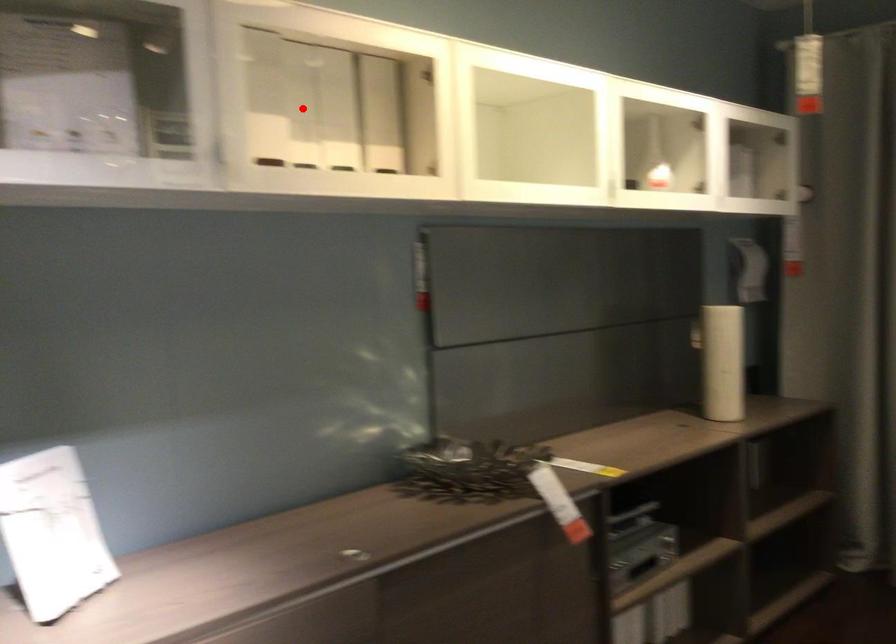
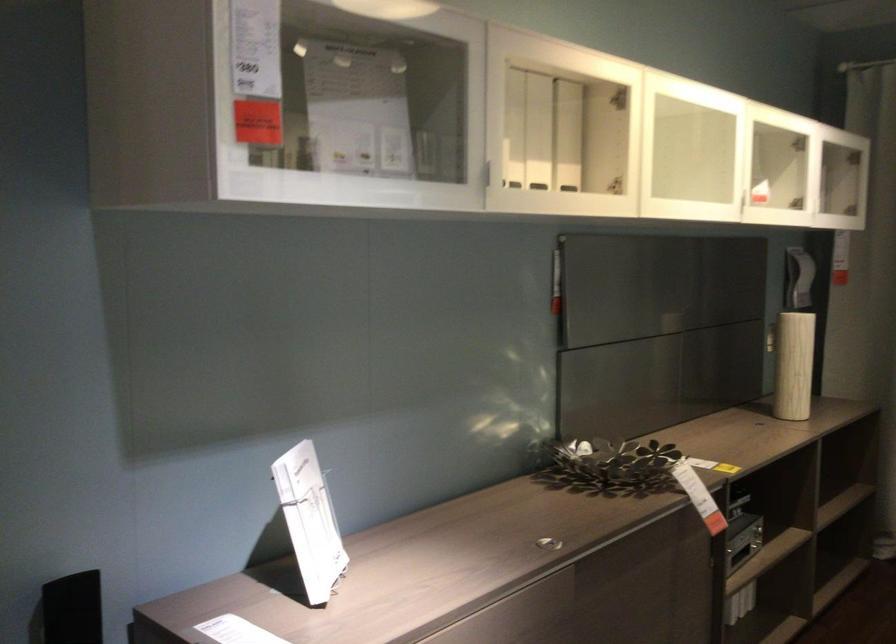
Find the pixel in the second image that matches the highlighted location in the first image.

(513, 128)